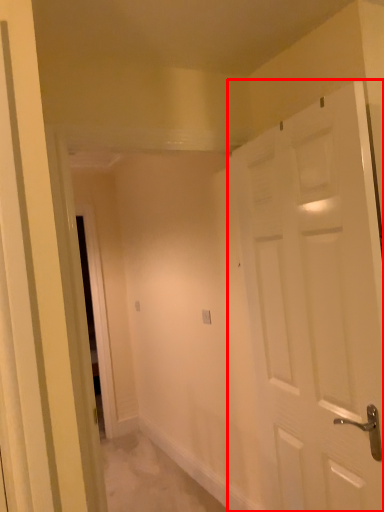
Question: Considering the relative positions of door (annotated by the red box) and electric outlet in the image provided, where is door (annotated by the red box) located with respect to the staircase?

Choices:
 (A) right
 (B) left

Answer: (A)